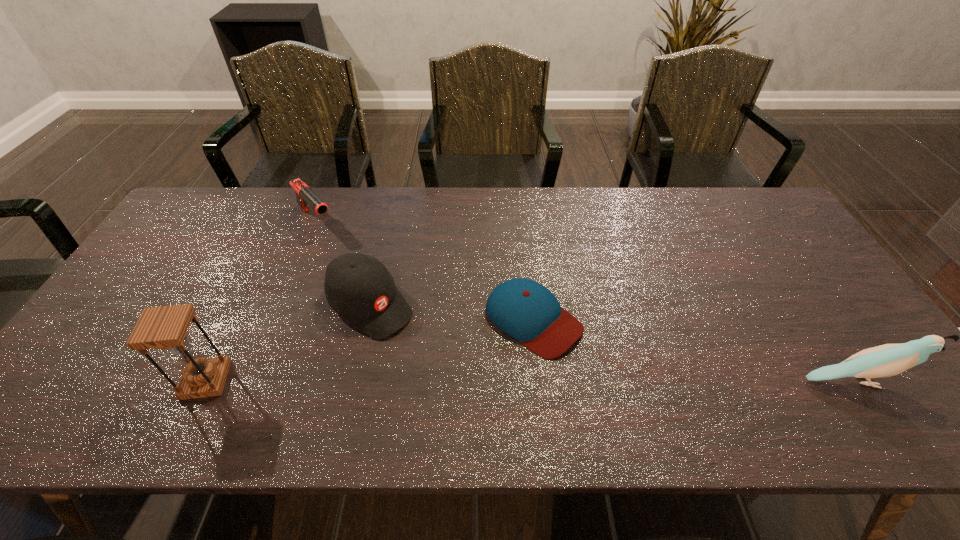
You are a GUI agent. You are given a task and a screenshot of the screen. Output one action in this format:
    pyautogui.click(x=<x>, y=<y>)
    Task: Click on the bird present at the near edge
    
    Given the screenshot: What is the action you would take?
    pyautogui.click(x=887, y=360)

This screenshot has height=540, width=960. I want to click on object that is at the right edge, so click(x=887, y=360).

Where is `object that is at the near right corner`? object that is at the near right corner is located at coordinates click(x=887, y=360).

The height and width of the screenshot is (540, 960). I want to click on free space at the far edge of the desktop, so click(x=246, y=200).

This screenshot has width=960, height=540. In the image, there is a desktop. Identify the location of vacant space at the left edge. (98, 346).

Where is `vacant area at the right edge`? This screenshot has width=960, height=540. vacant area at the right edge is located at coordinates coord(815,334).

Identify the location of free region at the far left corner. This screenshot has width=960, height=540. (208, 228).

Where is `vacant area at the near left corner`? This screenshot has height=540, width=960. vacant area at the near left corner is located at coordinates (126, 374).

Image resolution: width=960 pixels, height=540 pixels. Identify the location of vacant area that lies between the hourglass and the right baseball cap. (370, 350).

This screenshot has height=540, width=960. I want to click on vacant space that is in between the third object from right to left and the tallest object, so click(288, 343).